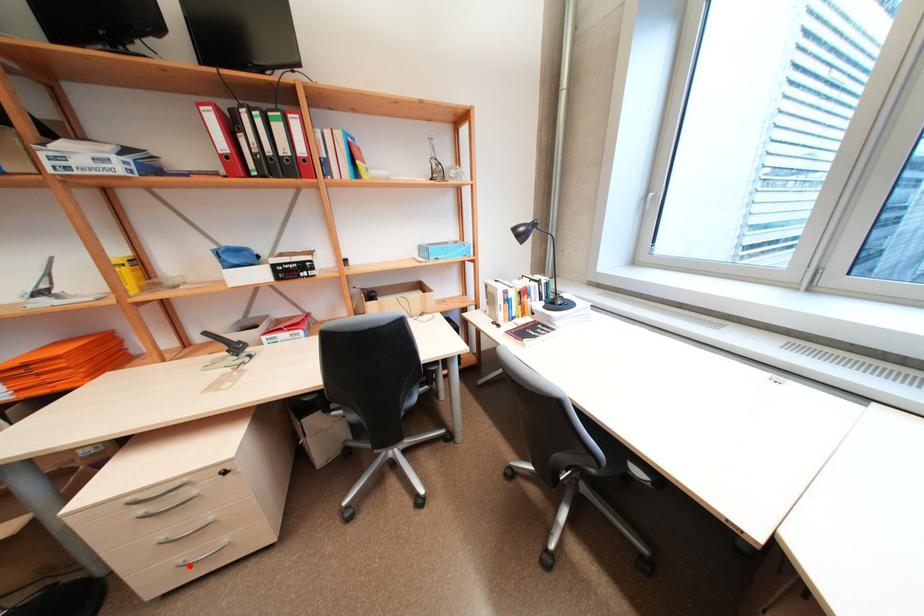
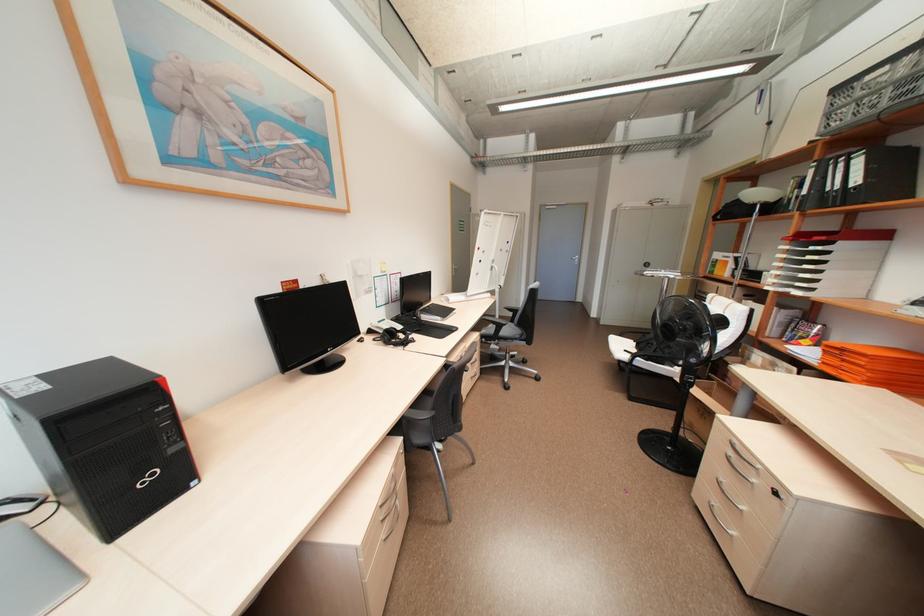
Question: I am providing you with two images of the same scene from different viewpoints. In image1, a red point is highlighted. Considering the same 3D point in image2, which of the following is correct?

Choices:
 (A) It is closer
 (B) It is farther

Answer: (B)